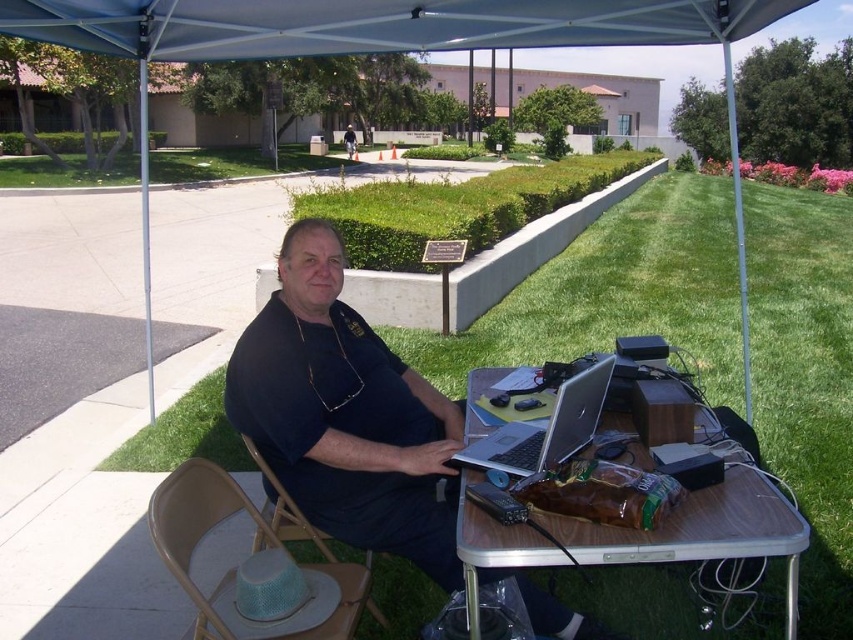
Question: Which object appears farthest from the camera in this image?

Choices:
 (A) wooden table at center
 (B) silver/black laptop at center

Answer: (B)

Question: Is black matte shirt at center positioned before white fabric canopy at upper center?

Choices:
 (A) yes
 (B) no

Answer: (A)

Question: Can you confirm if wooden table at center is positioned to the left of green mesh chair at lower center?

Choices:
 (A) yes
 (B) no

Answer: (B)

Question: Can you confirm if wooden table at center is positioned to the right of metallic tan folding chair at lower center?

Choices:
 (A) no
 (B) yes

Answer: (B)

Question: Estimate the real-world distances between objects in this image. Which object is closer to the metallic tan folding chair at lower center?

Choices:
 (A) white fabric canopy at upper center
 (B) matte black shirt at center
 (C) green mesh chair at lower center
 (D) wooden table at center

Answer: (C)

Question: Which object appears closest to the camera in this image?

Choices:
 (A) matte black shirt at center
 (B) wooden table at center
 (C) metallic tan folding chair at lower center

Answer: (B)